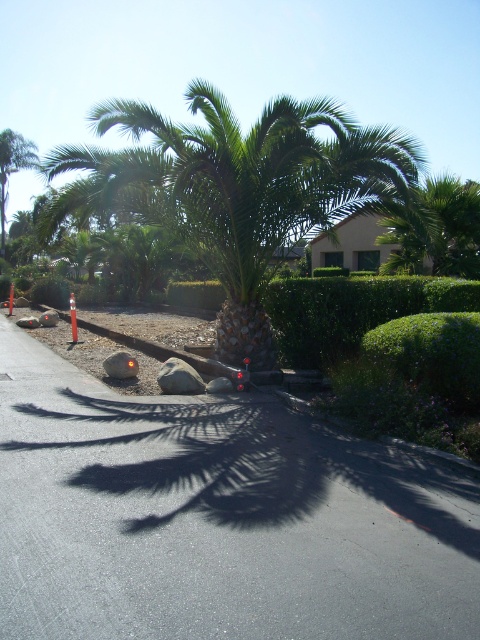
Based on the photo, which is above, gray rough rock at center or gray rock at center?

gray rock at center is higher up.

Looking at this image, who is lower down, gray rough rock at center or gray rock at center?

gray rough rock at center

Does point (160, 374) come farther from viewer compared to point (116, 364)?

No, it is in front of (116, 364).

At what (x,y) coordinates should I click in order to perform the action: click on gray rough rock at center. Please return your answer as a coordinate pair (x, y). Looking at the image, I should click on (179, 378).

Which is in front, point (35, 147) or point (113, 371)?

Positioned in front is point (113, 371).

Is green leafy palm tree at left above gray rock at center?

Yes, green leafy palm tree at left is above gray rock at center.

Who is more distant from viewer, (1,253) or (131,376)?

Positioned behind is point (1,253).

I want to click on green leafy palm tree at left, so click(x=12, y=168).

Does point (437, 472) come in front of point (164, 365)?

Yes, point (437, 472) is in front of point (164, 365).

Between asphalt at center and gray rough rock at center, which one appears on the left side from the viewer's perspective?

gray rough rock at center

Which is behind, point (395, 474) or point (162, 387)?

The point (162, 387) is more distant.

Find the location of a particular element. This screenshot has height=640, width=480. asphalt at center is located at coordinates (216, 518).